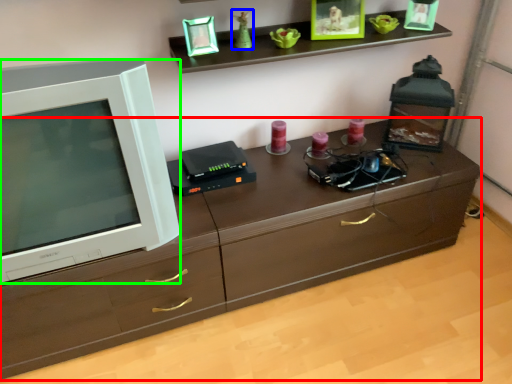
Question: Considering the real-world distances, which object is farthest from chest of drawers (highlighted by a red box)? toy (highlighted by a blue box) or television (highlighted by a green box)?

Choices:
 (A) toy
 (B) television

Answer: (A)